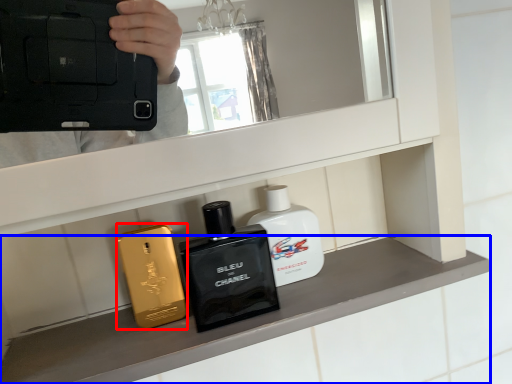
Question: Which object is further to the camera taking this photo, perfume (highlighted by a red box) or mantle (highlighted by a blue box)?

Choices:
 (A) perfume
 (B) mantle

Answer: (A)